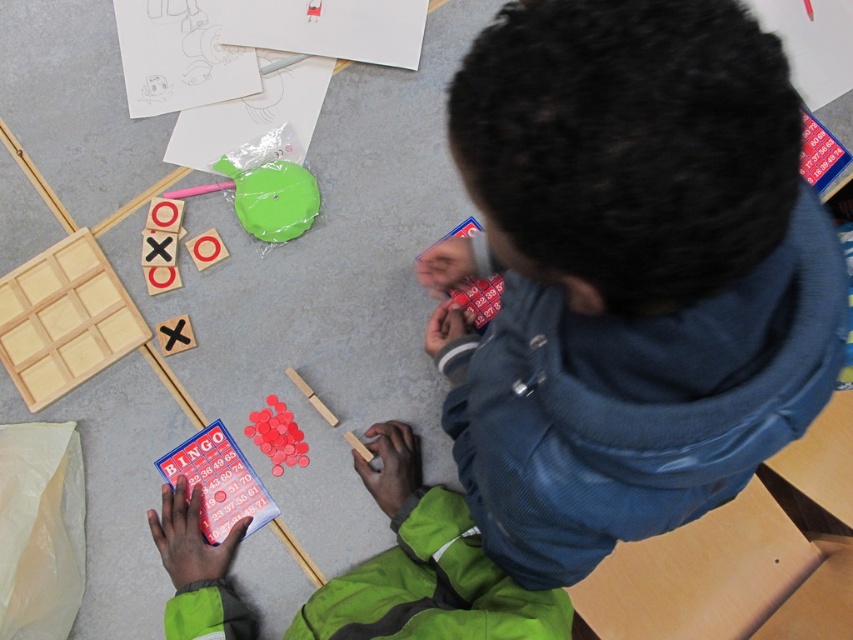
From the picture: Which of these two, green plastic lid at upper center or matte green circle at upper center, stands shorter?

matte green circle at upper center is shorter.

Does green plastic lid at upper center lie behind matte green circle at upper center?

No.

Is point (218, 166) positioned in front of point (194, 248)?

No, (218, 166) is further to viewer.

The height and width of the screenshot is (640, 853). In order to click on green plastic lid at upper center in this screenshot , I will do `click(271, 198)`.

Does blue corduroy jacket at upper right appear under green plastic lid at upper center?

Yes, blue corduroy jacket at upper right is below green plastic lid at upper center.

Identify the location of blue corduroy jacket at upper right. (637, 404).

Which is more to the right, blue corduroy jacket at upper right or matte green circle at upper center?

blue corduroy jacket at upper right is more to the right.

The height and width of the screenshot is (640, 853). Identify the location of blue corduroy jacket at upper right. (637, 404).

I want to click on blue corduroy jacket at upper right, so click(637, 404).